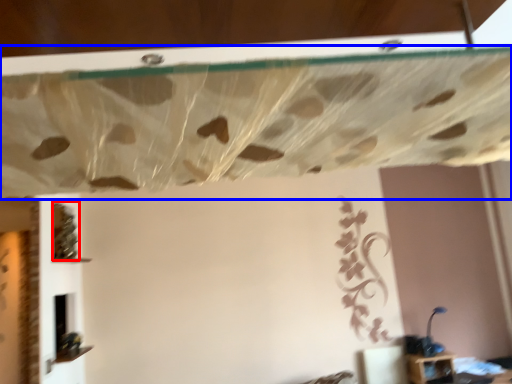
Question: Which of the following is the farthest to the observer, vine (highlighted by a red box) or curtain (highlighted by a blue box)?

Choices:
 (A) vine
 (B) curtain

Answer: (A)